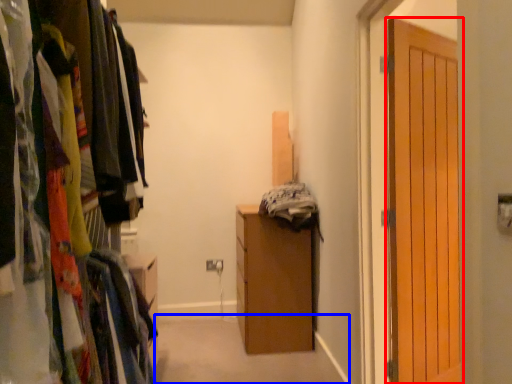
Question: Among these objects, which one is farthest to the camera, door (highlighted by a red box) or path (highlighted by a blue box)?

Choices:
 (A) door
 (B) path

Answer: (B)